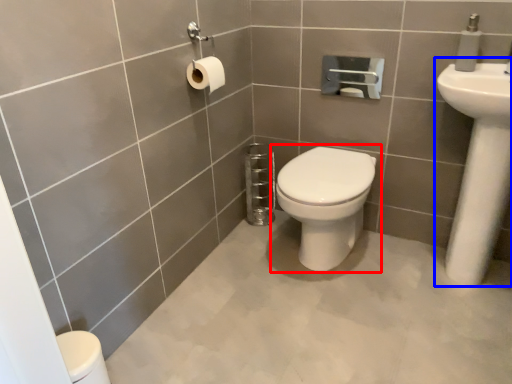
Question: Which point is closer to the camera, toilet (highlighted by a red box) or sink (highlighted by a blue box)?

Choices:
 (A) toilet
 (B) sink

Answer: (B)